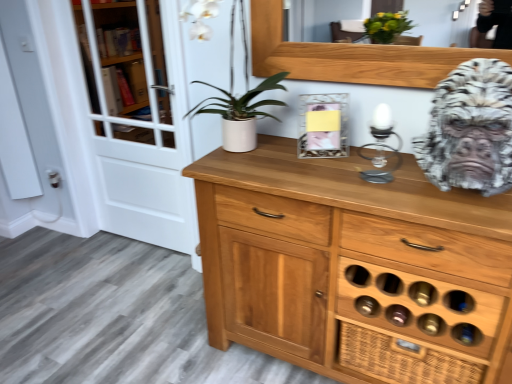
Question: Does white glass screen door at left lie behind white matte pot at center?

Choices:
 (A) yes
 (B) no

Answer: (A)

Question: Considering the relative sizes of white glass screen door at left and white matte pot at center in the image provided, is white glass screen door at left bigger than white matte pot at center?

Choices:
 (A) no
 (B) yes

Answer: (B)

Question: From the image's perspective, would you say white glass screen door at left is shown under white matte pot at center?

Choices:
 (A) no
 (B) yes

Answer: (B)

Question: Does white glass screen door at left appear on the left side of white matte pot at center?

Choices:
 (A) no
 (B) yes

Answer: (B)

Question: From the image's perspective, is white glass screen door at left above white matte pot at center?

Choices:
 (A) yes
 (B) no

Answer: (B)

Question: From a real-world perspective, is white glass screen door at left under white matte pot at center?

Choices:
 (A) yes
 (B) no

Answer: (A)

Question: Is white marble gorilla head at right facing towards white glass screen door at left?

Choices:
 (A) no
 (B) yes

Answer: (A)

Question: Considering the relative positions of white marble gorilla head at right and white glass screen door at left in the image provided, is white marble gorilla head at right to the left of white glass screen door at left from the viewer's perspective?

Choices:
 (A) yes
 (B) no

Answer: (B)

Question: From a real-world perspective, is white marble gorilla head at right on top of white glass screen door at left?

Choices:
 (A) yes
 (B) no

Answer: (A)

Question: Is white marble gorilla head at right surrounding white glass screen door at left?

Choices:
 (A) yes
 (B) no

Answer: (B)

Question: Is white marble gorilla head at right positioned far away from white glass screen door at left?

Choices:
 (A) yes
 (B) no

Answer: (A)

Question: From a real-world perspective, does white marble gorilla head at right sit lower than white glass screen door at left?

Choices:
 (A) yes
 (B) no

Answer: (B)

Question: From the image's perspective, would you say white marble gorilla head at right is positioned over white matte pot at center?

Choices:
 (A) yes
 (B) no

Answer: (B)